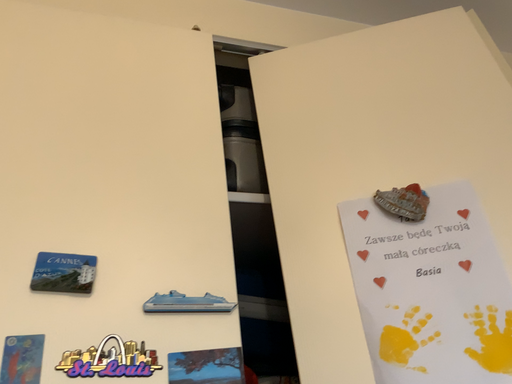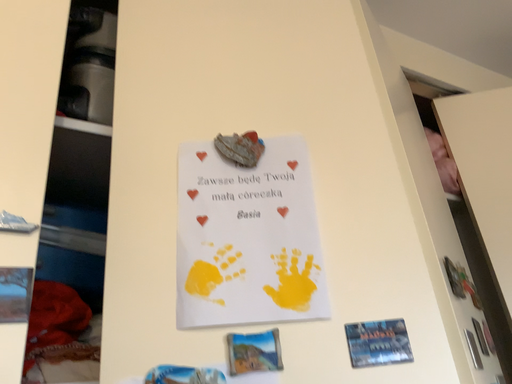
Question: How did the camera likely rotate when shooting the video?

Choices:
 (A) rotated left
 (B) rotated right

Answer: (B)